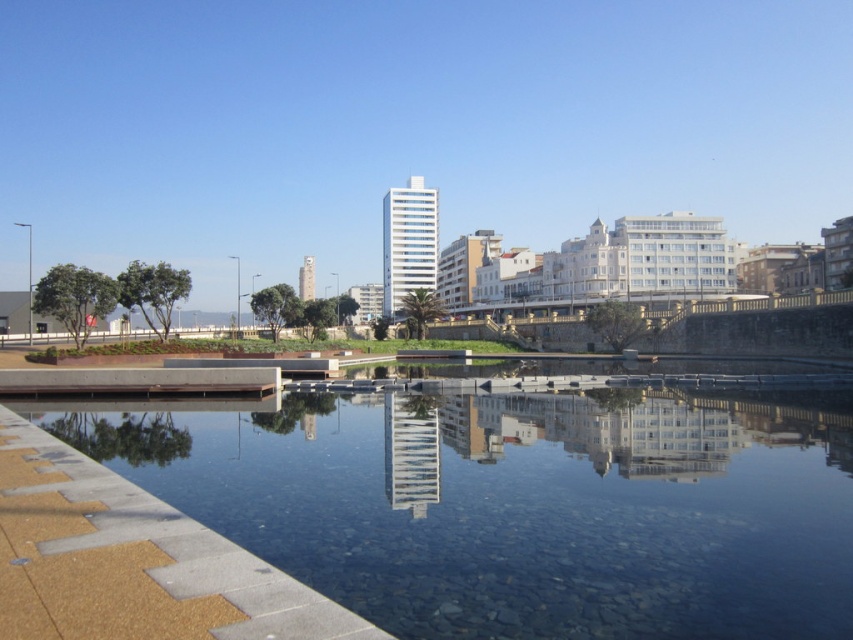
You are a landscape architect designing a new pathway. You have to decide whether to place a 3x3 meter decorative fountain in the smooth concrete river at center or the brown textured paving at lower left. Based on their sizes, which location would be more suitable?

The smooth concrete river at center is larger in size than the brown textured paving at lower left, so placing the 3x3 meter decorative fountain in the smooth concrete river at center would be more suitable as it has enough space.

You are standing at the edge of the brown textured paving at lower left and want to cross to the smooth concrete river at center. Which direction should you move to reach it?

The smooth concrete river at center is positioned on the right side of brown textured paving at lower left, so you should move to your right to reach it.

You are standing at the waterfront and want to know how far you are from the point marked at coordinates (546, 515). Can you determine the distance?

The point marked at coordinates (546, 515) is 8.02 meters away from you.